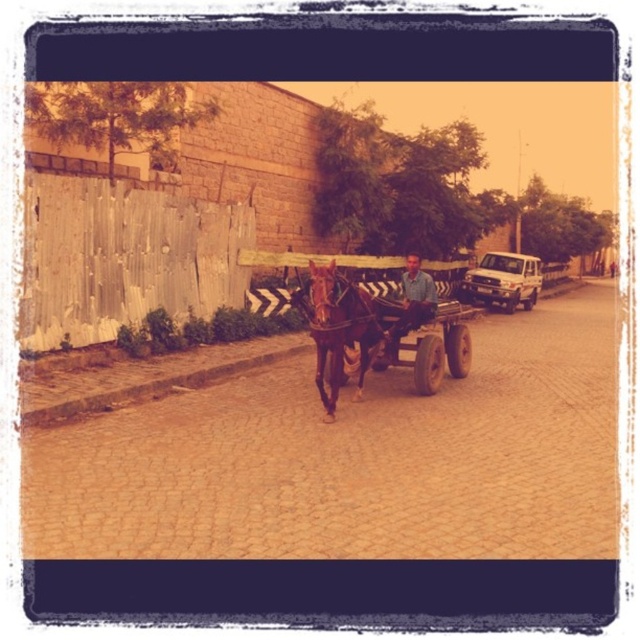
Is brown glossy horse at center shorter than white matte truck at right?

Yes.

Can you confirm if brown glossy horse at center is taller than white matte truck at right?

No.

Is point (321, 330) farther from camera compared to point (515, 260)?

No, it is in front of (515, 260).

The height and width of the screenshot is (640, 640). What are the coordinates of `brown glossy horse at center` in the screenshot? It's located at (339, 328).

Is brown wooden cart at center in front of white matte truck at right?

Yes, it is in front of white matte truck at right.

Between brown wooden cart at center and white matte truck at right, which one is positioned higher?

white matte truck at right is above.

At what (x,y) coordinates should I click in order to perform the action: click on brown wooden cart at center. Please return your answer as a coordinate pair (x, y). Looking at the image, I should click on coord(378,332).

At what (x,y) coordinates should I click in order to perform the action: click on brown wooden cart at center. Please return your answer as a coordinate pair (x, y). Looking at the image, I should click on (378, 332).

Is brown wooden cart at center further to the viewer compared to matte blue shirt at center?

No, it is in front of matte blue shirt at center.

Does brown wooden cart at center appear on the left side of matte blue shirt at center?

Yes, brown wooden cart at center is to the left of matte blue shirt at center.

Is point (356, 292) behind point (404, 285)?

No, it is not.

I want to click on brown wooden cart at center, so click(378, 332).